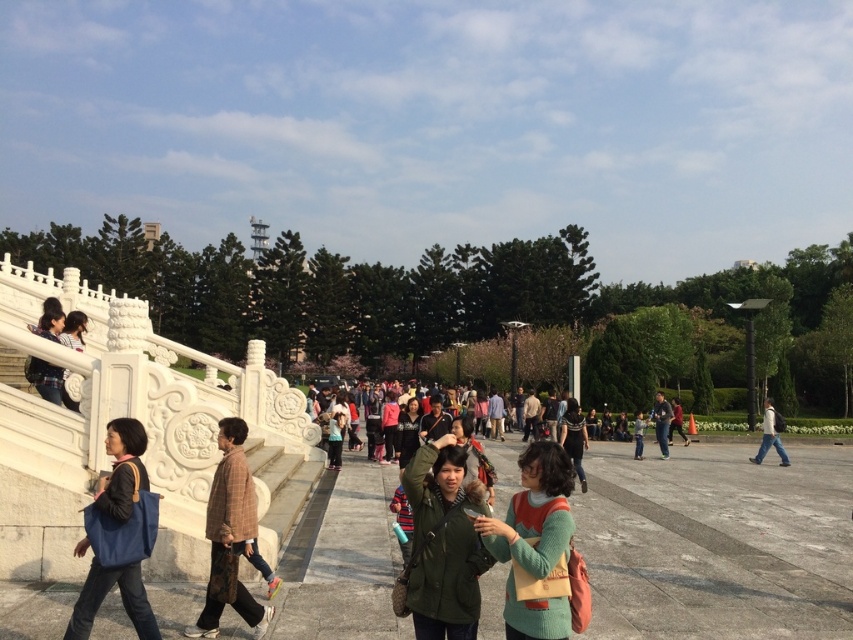
You are standing at the bottom of the white stone staircase in the public square and see both the green knitted sweater at center and the green fabric jacket at center. Which one is positioned to the left?

The green knitted sweater at center is positioned to the left of the green fabric jacket at center.

You are standing in the public square and see a person wearing a brown plaid shirt at center and dark blue jeans at center. Which part of their clothing is nearer to you?

The brown plaid shirt at center is closer to the viewer than the dark blue jeans at center.

You are a photographer trying to capture both the green matte jacket at center and the matte black jacket at upper left in one frame. Which jacket should you focus on first to ensure both are visible in your photo?

You should focus on the green matte jacket at center first because it is in front of the matte black jacket at upper left, ensuring both will be visible when centered on the foreground object.